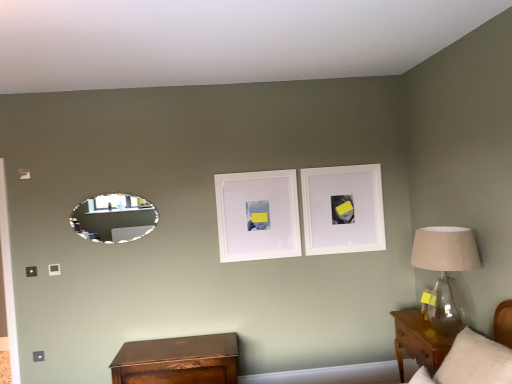
Question: Should I look upward or downward to see white matte picture frame at center, which is the 1th picture frame from left to right?

Choices:
 (A) up
 (B) down

Answer: (B)

Question: Is white matte picture frame at center, which is the 1th picture frame from left to right, at the back of white matte picture frame at upper center, which is the 1th picture frame from right to left?

Choices:
 (A) no
 (B) yes

Answer: (A)

Question: Considering the relative sizes of white matte picture frame at upper center, which is the 1th picture frame from right to left, and white matte picture frame at center, the 2th picture frame when ordered from right to left, in the image provided, is white matte picture frame at upper center, which is the 1th picture frame from right to left, taller than white matte picture frame at center, the 2th picture frame when ordered from right to left,?

Choices:
 (A) no
 (B) yes

Answer: (B)

Question: From the image's perspective, does white matte picture frame at upper center, which is the 1th picture frame from right to left, appear higher than white matte picture frame at center, the 2th picture frame when ordered from right to left?

Choices:
 (A) yes
 (B) no

Answer: (A)

Question: Is white matte picture frame at upper center, the 2th picture frame viewed from the left, wider than white matte picture frame at center, the 2th picture frame when ordered from right to left?

Choices:
 (A) no
 (B) yes

Answer: (B)

Question: Would you say white matte picture frame at upper center, the 2th picture frame viewed from the left, is outside white matte picture frame at center, which is the 1th picture frame from left to right?

Choices:
 (A) yes
 (B) no

Answer: (A)

Question: From a real-world perspective, is white matte picture frame at upper center, the 2th picture frame viewed from the left, on white matte picture frame at center, which is the 1th picture frame from left to right?

Choices:
 (A) yes
 (B) no

Answer: (A)

Question: Considering the relative sizes of white matte picture frame at center, the 2th picture frame when ordered from right to left, and oval silver mirror at left in the image provided, is white matte picture frame at center, the 2th picture frame when ordered from right to left, smaller than oval silver mirror at left?

Choices:
 (A) yes
 (B) no

Answer: (A)

Question: Is white matte picture frame at center, the 2th picture frame when ordered from right to left, taller than oval silver mirror at left?

Choices:
 (A) no
 (B) yes

Answer: (B)

Question: Is white matte picture frame at center, the 2th picture frame when ordered from right to left, positioned far away from oval silver mirror at left?

Choices:
 (A) yes
 (B) no

Answer: (B)

Question: Is white matte picture frame at center, which is the 1th picture frame from left to right, with oval silver mirror at left?

Choices:
 (A) no
 (B) yes

Answer: (A)

Question: Can you confirm if white matte picture frame at center, the 2th picture frame when ordered from right to left, is shorter than oval silver mirror at left?

Choices:
 (A) yes
 (B) no

Answer: (B)

Question: Is white matte picture frame at center, which is the 1th picture frame from left to right, oriented away from oval silver mirror at left?

Choices:
 (A) no
 (B) yes

Answer: (A)

Question: Does white matte picture frame at upper center, which is the 1th picture frame from right to left, come behind brown wood nightstand at lower right, which is the 1th nightstand in right-to-left order?

Choices:
 (A) yes
 (B) no

Answer: (A)